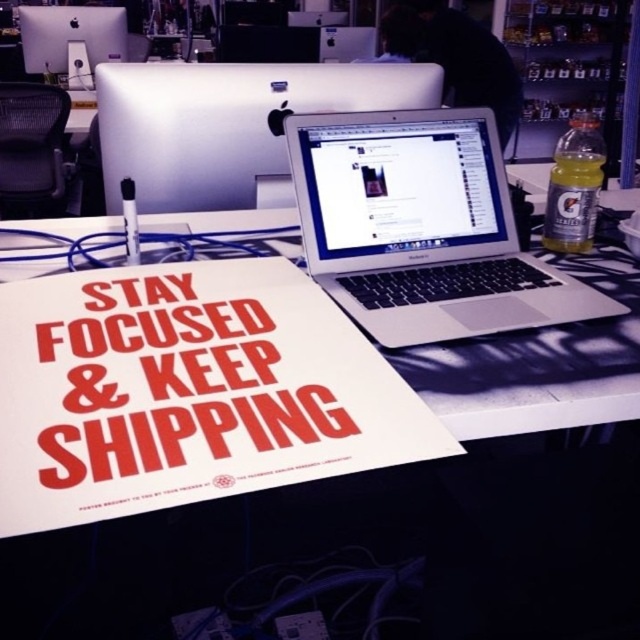
Question: Can you confirm if black mesh chair at upper left is positioned to the right of matte black monitor at upper left?

Choices:
 (A) yes
 (B) no

Answer: (A)

Question: Among these objects, which one is nearest to the camera?

Choices:
 (A) sleek silver laptop at center
 (B) black mesh chair at upper left

Answer: (A)

Question: Among these points, which one is farthest from the camera?

Choices:
 (A) (518, 573)
 (B) (317, 84)
 (C) (51, 40)
 (D) (20, 145)

Answer: (C)

Question: In this image, where is sleek silver monitor at upper center located relative to matte black monitor at upper left?

Choices:
 (A) above
 (B) below

Answer: (B)

Question: Does sleek silver laptop at center appear over black mesh chair at upper left?

Choices:
 (A) yes
 (B) no

Answer: (B)

Question: Based on their relative distances, which object is farther from the matte black monitor at upper left?

Choices:
 (A) black mesh chair at upper left
 (B) white plastic desk at center

Answer: (B)